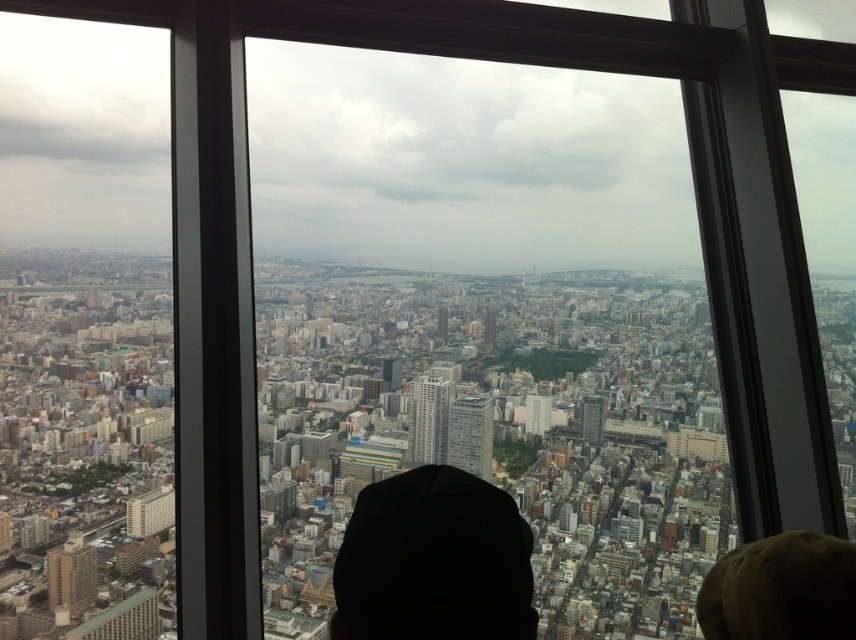
Question: Among these points, which one is nearest to the camera?

Choices:
 (A) (525, 612)
 (B) (807, 579)

Answer: (B)

Question: Is black fabric cap at center further to camera compared to brown fuzzy hat at lower right?

Choices:
 (A) yes
 (B) no

Answer: (A)

Question: Is black fabric cap at center to the right of brown fuzzy hat at lower right from the viewer's perspective?

Choices:
 (A) no
 (B) yes

Answer: (A)

Question: Can you confirm if black fabric cap at center is smaller than brown fuzzy hat at lower right?

Choices:
 (A) no
 (B) yes

Answer: (A)